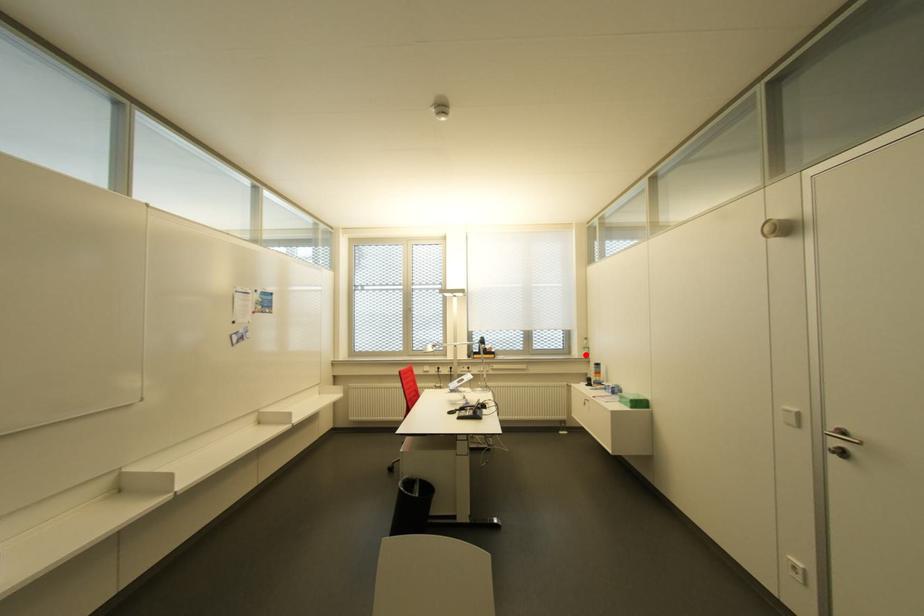
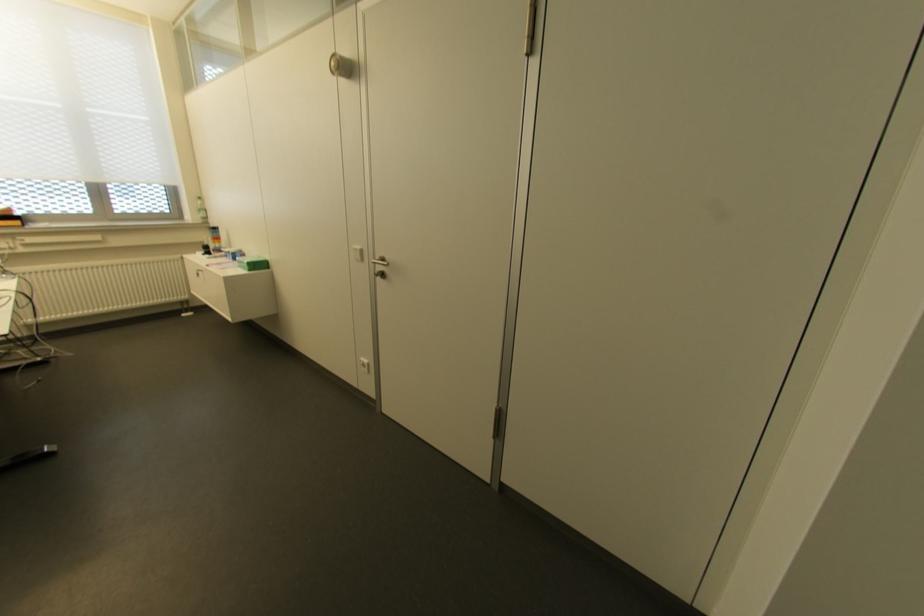
Where in the second image is the point corresponding to the highlighted location from the first image?

(204, 217)